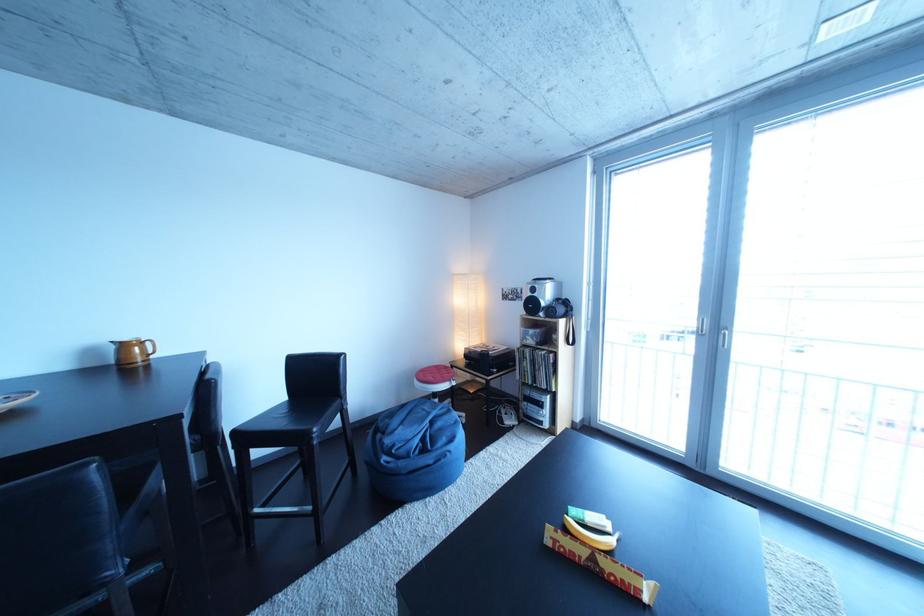
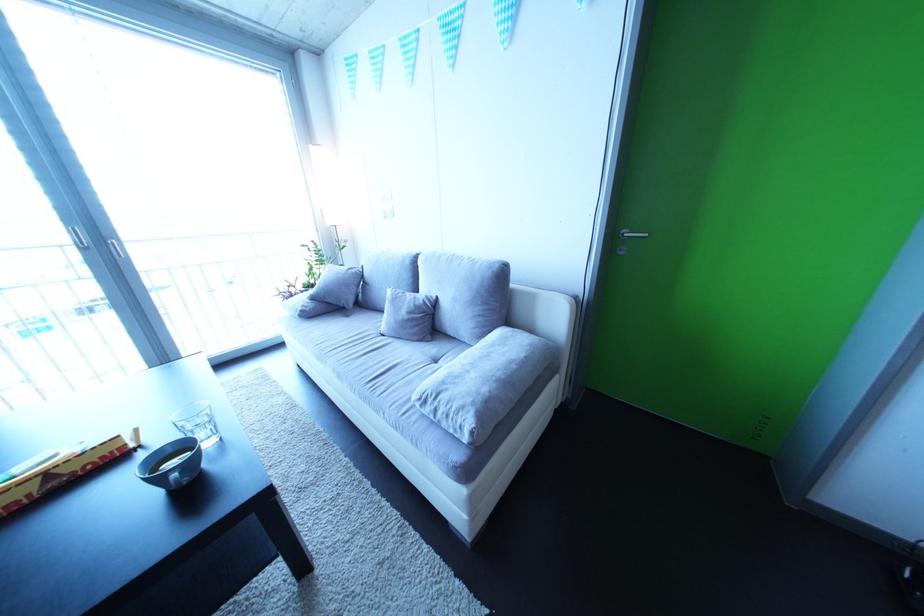
The images are taken continuously from a first-person perspective. In which direction is your viewpoint rotating?

The camera's rotation is toward right-down.